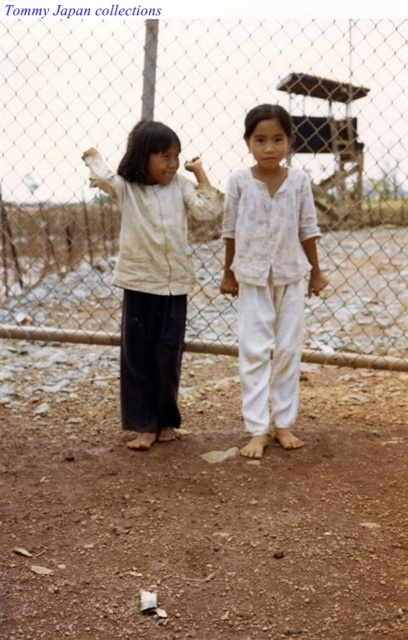
You are a drone operator trying to capture aerial footage of two children in a rural area. You have two specific points marked on your map for camera positioning. The first point is at coordinates point (x=193, y=44) and the second at point (x=124, y=360). According to the scene description, which point is positioned further back from the viewer?

Point (x=193, y=44) is behind point (x=124, y=360), so the first point is further back from the viewer.

Based on the photo, you are a delivery drone trying to land in the area shown. The landing pad is at point 0.500, 0.500. The wire mesh fence at center is in the way. Can you fly around it to reach the landing pad?

The wire mesh fence at center is located at point (204,160). Since the landing pad is at (204,320), the fence is directly between you and the landing pad along the same horizontal axis. To reach the landing pad, you can fly either above the fence or to the side, but since the fence is at the center, moving to the right or left along the same line would bypass it. However, the exact path depends on the fence height and clearance. If the fence is low enough, flying over it might be possible. If not, cir